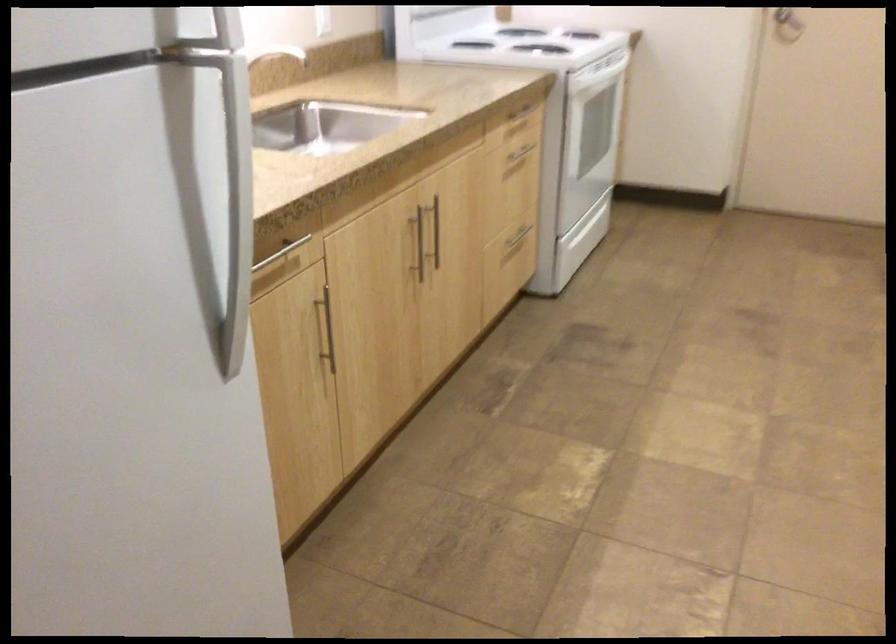
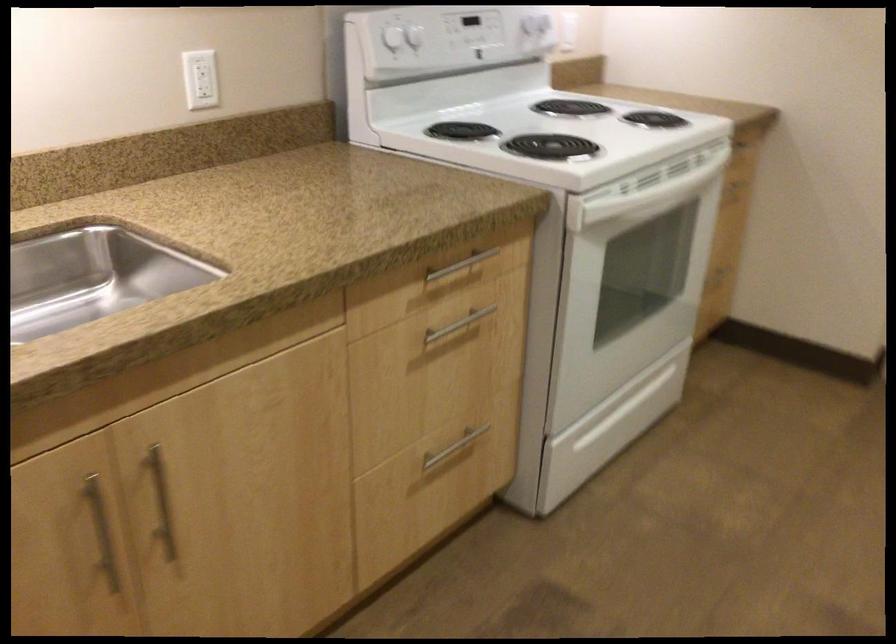
The point at [521,149] is marked in the first image. Where is the corresponding point in the second image?

(457, 325)